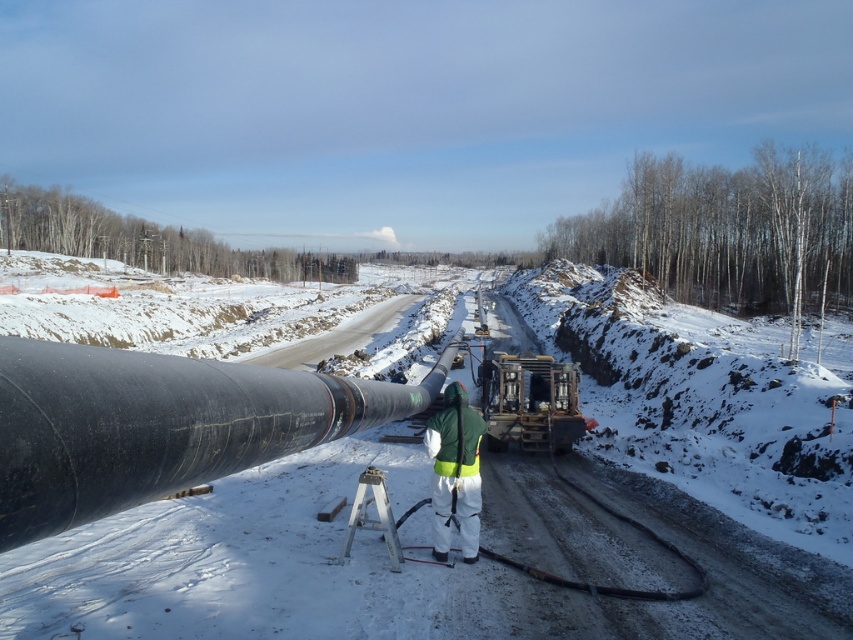
Question: Can you confirm if metallic yellow forklift at center is positioned above green reflective safety suit at center?

Choices:
 (A) no
 (B) yes

Answer: (A)

Question: Is black rubber pipe at center closer to the viewer compared to green reflective safety suit at center?

Choices:
 (A) yes
 (B) no

Answer: (A)

Question: Which point is farther to the camera?

Choices:
 (A) (683, 616)
 (B) (569, 440)
 (C) (190, 362)

Answer: (B)

Question: Which object is farther from the camera taking this photo?

Choices:
 (A) green reflective safety suit at center
 (B) black rubber pipe at center
 (C) black rubber pipe at left
 (D) metallic yellow forklift at center

Answer: (D)

Question: Estimate the real-world distances between objects in this image. Which object is closer to the metallic yellow forklift at center?

Choices:
 (A) black rubber pipe at left
 (B) green reflective safety suit at center

Answer: (A)

Question: Is metallic yellow forklift at center to the left of green reflective safety suit at center from the viewer's perspective?

Choices:
 (A) yes
 (B) no

Answer: (B)